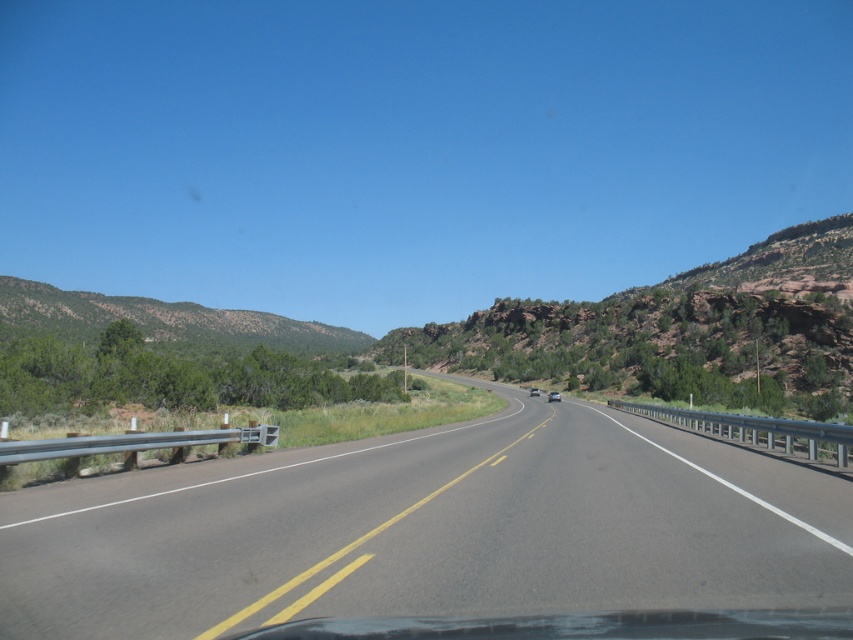
Is asphalt road at center thinner than white glossy sedan at center?

No, asphalt road at center is not thinner than white glossy sedan at center.

Does asphalt road at center lie in front of white glossy sedan at center?

Yes, asphalt road at center is closer to the viewer.

Find the location of `asphalt road at center`. asphalt road at center is located at coordinates (428, 529).

Is green textured hillside at left positioned at the back of metallic silver sedan at center?

Yes, green textured hillside at left is further from the viewer.

Between point (35, 285) and point (558, 400), which one is positioned in front?

Point (558, 400) is in front.

This screenshot has height=640, width=853. In order to click on green textured hillside at left in this screenshot , I will do `click(163, 321)`.

Does asphalt road at center have a lesser width compared to metallic silver sedan at center?

No, asphalt road at center is not thinner than metallic silver sedan at center.

Is point (799, 499) less distant than point (553, 401)?

Yes, it is.

Measure the distance between point (720,564) and camera.

Point (720,564) is 6.47 meters away from camera.

Where is `asphalt road at center`? Image resolution: width=853 pixels, height=640 pixels. asphalt road at center is located at coordinates (428, 529).